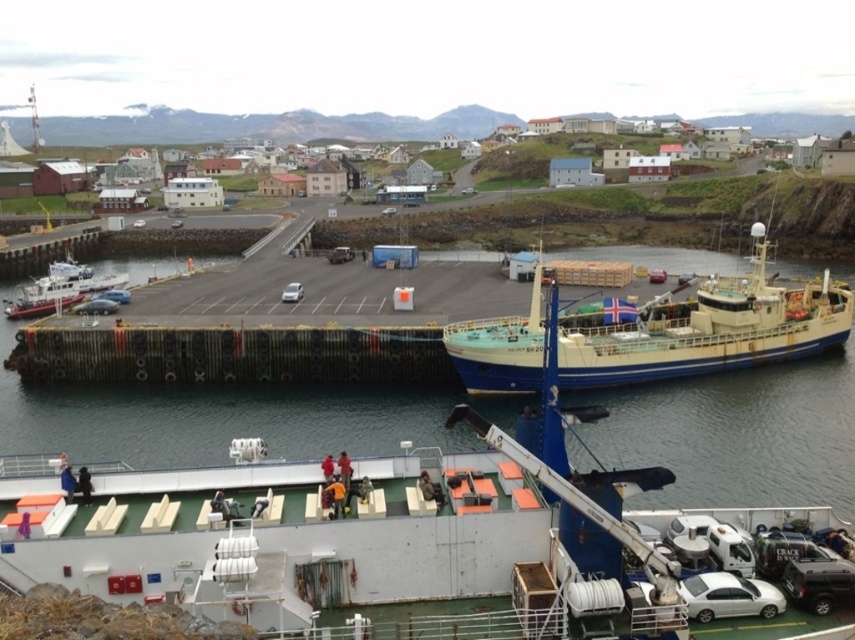
You are a delivery driver who needs to park your white matte sedan at lower right near the blue painted steel boat at center. Can you park your car directly to the left of the boat?

The blue painted steel boat at center is to the right of white matte sedan at lower right, so yes, the white matte sedan at lower right can be parked directly to the left of the blue painted steel boat at center since it is already positioned that way.

You are a delivery person needing to transport a 150 feet long cargo from the white matte boat at center to the white matte car at center. Can you fit the cargo between them without bending it?

The distance between the white matte boat at center and the white matte car at center is 136.19 feet, which is shorter than the 150 feet long cargo. Therefore, the cargo cannot be transported straight between them without bending.